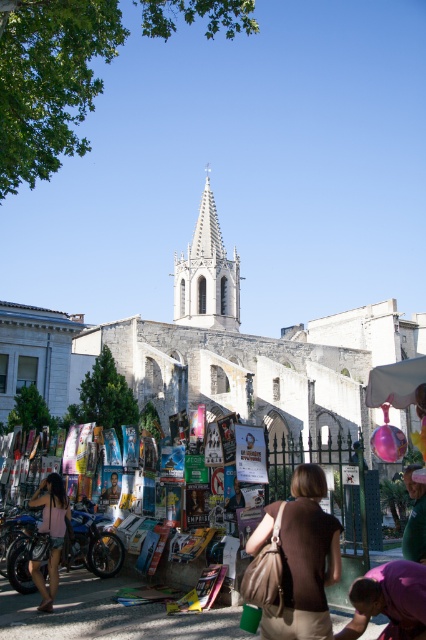
Is white stone church at center further to camera compared to blue metallic motorcycle at lower left?

Yes, white stone church at center is further from the viewer.

Which of these two, white stone church at center or blue metallic motorcycle at lower left, stands taller?

white stone church at center

In order to click on white stone church at center in this screenshot , I will do `click(253, 349)`.

Is white stone church at center shorter than white stone spire at center?

Incorrect, white stone church at center's height does not fall short of white stone spire at center's.

How far apart are white stone church at center and white stone spire at center?

white stone church at center and white stone spire at center are 14.71 meters apart from each other.

Is point (282, 376) positioned before point (218, 310)?

Yes, it is.

In order to click on white stone church at center in this screenshot , I will do `click(253, 349)`.

Where is `brown fabric bag at center`? brown fabric bag at center is located at coordinates (305, 561).

Who is higher up, brown fabric bag at center or blue metallic motorcycle at lower left?

brown fabric bag at center is higher up.

Image resolution: width=426 pixels, height=640 pixels. What are the coordinates of `brown fabric bag at center` in the screenshot? It's located at (305, 561).